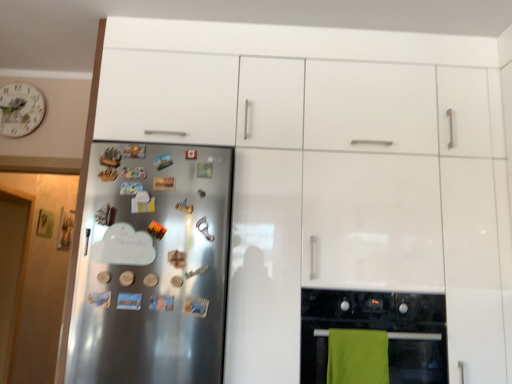
Question: Is the depth of green fabric towel at lower center greater than that of black glass oven at lower right?

Choices:
 (A) yes
 (B) no

Answer: (B)

Question: Is green fabric towel at lower center smaller than black glass oven at lower right?

Choices:
 (A) no
 (B) yes

Answer: (B)

Question: Is green fabric towel at lower center turned away from black glass oven at lower right?

Choices:
 (A) no
 (B) yes

Answer: (B)

Question: Does green fabric towel at lower center appear on the right side of black glass oven at lower right?

Choices:
 (A) no
 (B) yes

Answer: (A)

Question: From a real-world perspective, is green fabric towel at lower center below black glass oven at lower right?

Choices:
 (A) no
 (B) yes

Answer: (B)

Question: Could you tell me if green fabric towel at lower center is facing black glass oven at lower right?

Choices:
 (A) no
 (B) yes

Answer: (B)

Question: Does black glass oven at lower right have a greater height compared to white floral clock at upper left?

Choices:
 (A) no
 (B) yes

Answer: (B)

Question: Is there a large distance between black glass oven at lower right and white floral clock at upper left?

Choices:
 (A) yes
 (B) no

Answer: (A)

Question: Is black glass oven at lower right positioned in front of white floral clock at upper left?

Choices:
 (A) yes
 (B) no

Answer: (A)

Question: Is black glass oven at lower right next to white floral clock at upper left?

Choices:
 (A) yes
 (B) no

Answer: (B)

Question: From a real-world perspective, is black glass oven at lower right positioned over white floral clock at upper left based on gravity?

Choices:
 (A) yes
 (B) no

Answer: (B)

Question: Can you confirm if black glass oven at lower right is positioned to the left of white floral clock at upper left?

Choices:
 (A) no
 (B) yes

Answer: (A)

Question: From a real-world perspective, does satin silver fridge at left stand above white floral clock at upper left?

Choices:
 (A) no
 (B) yes

Answer: (A)